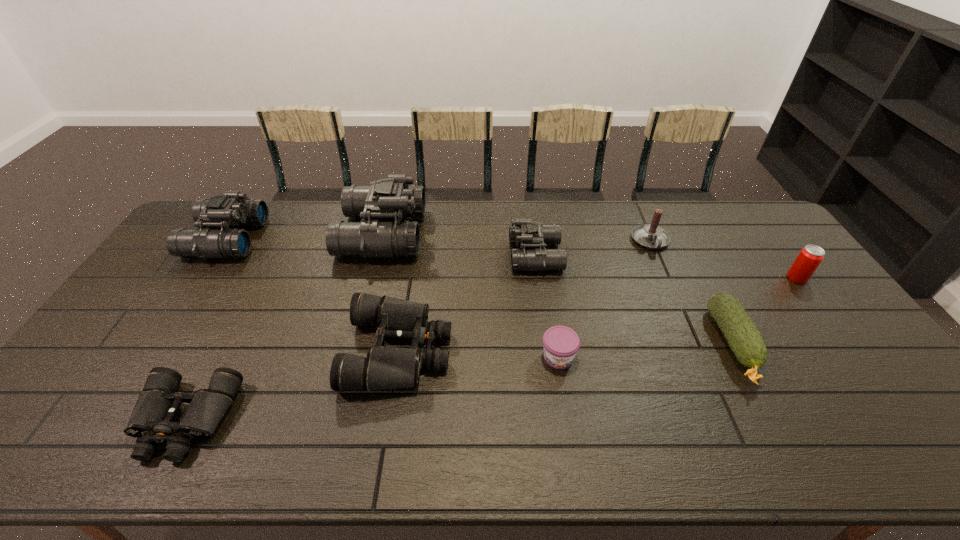
This screenshot has height=540, width=960. Find the location of `vacant area at the far edge`. vacant area at the far edge is located at coordinates (561, 222).

In the image, there is a desktop. Identify the location of free space at the near edge. (401, 447).

In the image, there is a desktop. At what (x,y) coordinates should I click in order to perform the action: click on free region at the right edge. Please return your answer as a coordinate pair (x, y). Image resolution: width=960 pixels, height=540 pixels. Looking at the image, I should click on (893, 396).

Image resolution: width=960 pixels, height=540 pixels. In order to click on vacant space that's between the smaller black binoculars and the green cucumber in this screenshot , I will do `click(460, 382)`.

Identify the location of unoccupied area between the left black binoculars and the smallest blue binoculars. The image size is (960, 540). (360, 338).

Find the location of a particular element. The width and height of the screenshot is (960, 540). vacant space in between the rightmost binoculars and the tallest object is located at coordinates (459, 245).

Where is `free space between the jam and the rightmost binoculars`? This screenshot has width=960, height=540. free space between the jam and the rightmost binoculars is located at coordinates (547, 306).

Find the location of `vacant area between the second blue binoculars from right to left and the left black binoculars`. vacant area between the second blue binoculars from right to left and the left black binoculars is located at coordinates (x=284, y=327).

Where is `unoccupied area between the rightmost blue binoculars and the green cucumber`? unoccupied area between the rightmost blue binoculars and the green cucumber is located at coordinates (635, 300).

Image resolution: width=960 pixels, height=540 pixels. I want to click on free space between the jam and the tallest object, so click(470, 295).